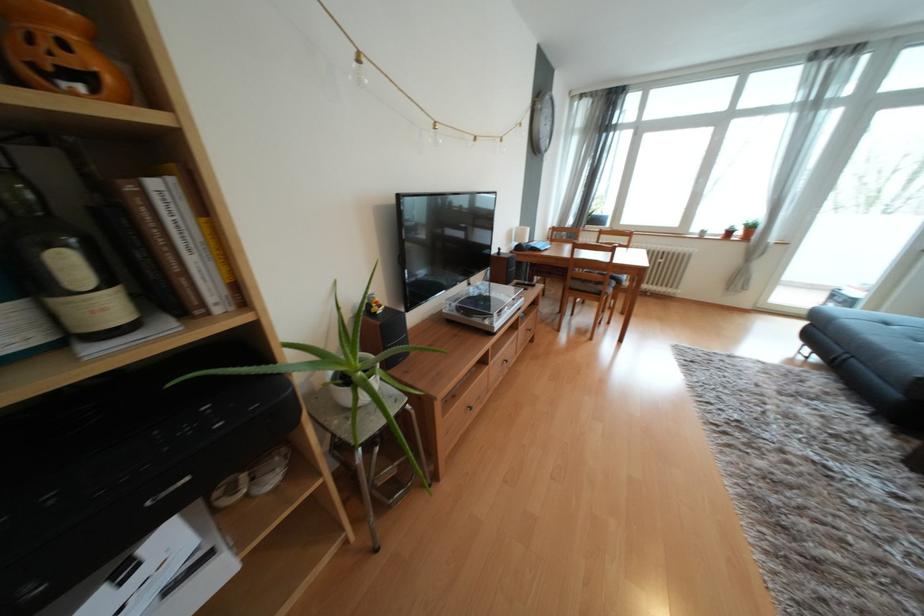
Where would you lift the white plant pot? Please return your answer as a coordinate pair (x, y).

(349, 387)